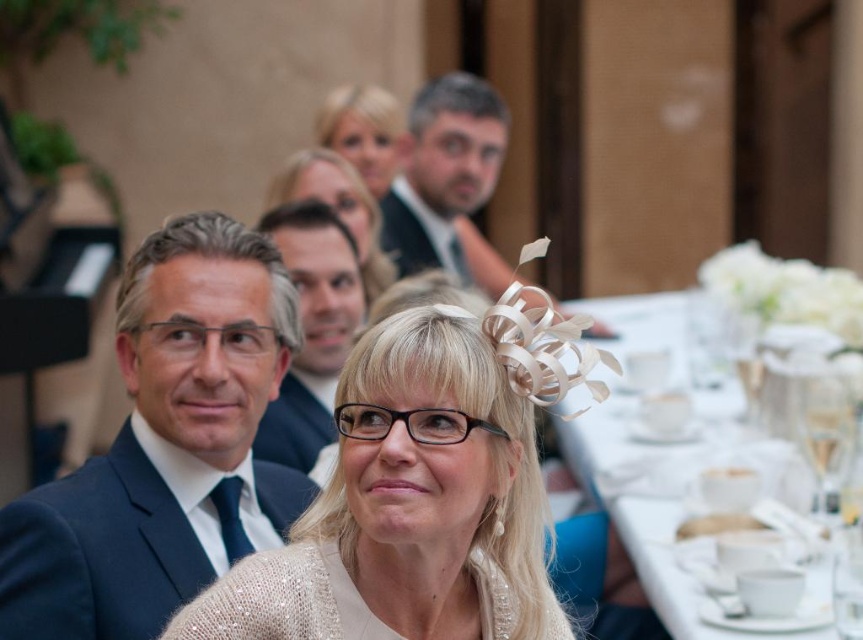
Who is lower down, dark blue suit at center or matte black suit at center?

dark blue suit at center

Which is more to the left, dark blue suit at center or matte black suit at center?

Positioned to the left is dark blue suit at center.

You are a GUI agent. You are given a task and a screenshot of the screen. Output one action in this format:
    pyautogui.click(x=<x>, y=<y>)
    Task: Click on the dark blue suit at center
    The image size is (863, 640).
    Given the screenshot: What is the action you would take?
    pyautogui.click(x=165, y=445)

This screenshot has height=640, width=863. In order to click on dark blue suit at center in this screenshot , I will do `click(165, 445)`.

In the scene shown: Between white porcelain cups at upper right and smooth dark brown suit at center, which one appears on the right side from the viewer's perspective?

From the viewer's perspective, white porcelain cups at upper right appears more on the right side.

Is white porcelain cups at upper right to the left of smooth dark brown suit at center from the viewer's perspective?

In fact, white porcelain cups at upper right is to the right of smooth dark brown suit at center.

Who is more forward, (x=671, y=563) or (x=387, y=246)?

Point (x=671, y=563) is more forward.

You are a GUI agent. You are given a task and a screenshot of the screen. Output one action in this format:
    pyautogui.click(x=<x>, y=<y>)
    Task: Click on the white porcelain cups at upper right
    The height and width of the screenshot is (640, 863).
    Given the screenshot: What is the action you would take?
    pyautogui.click(x=672, y=458)

Is smooth dark brown suit at center below blonde hair at upper center?

Yes.

Between smooth dark brown suit at center and blonde hair at upper center, which one appears on the left side from the viewer's perspective?

From the viewer's perspective, blonde hair at upper center appears more on the left side.

Is point (473, 204) less distant than point (328, 122)?

No, (473, 204) is behind (328, 122).

Find the location of a particular element. The width and height of the screenshot is (863, 640). smooth dark brown suit at center is located at coordinates (446, 180).